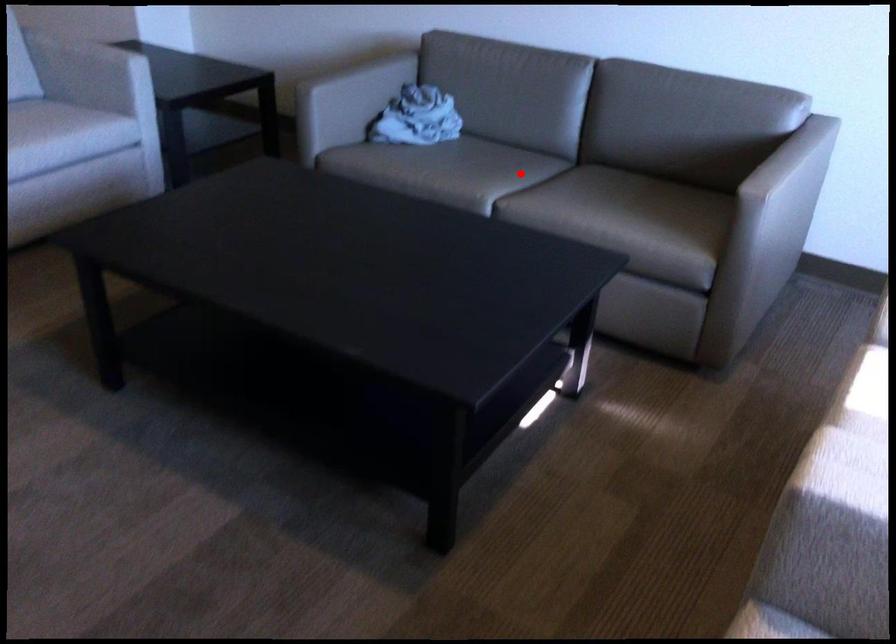
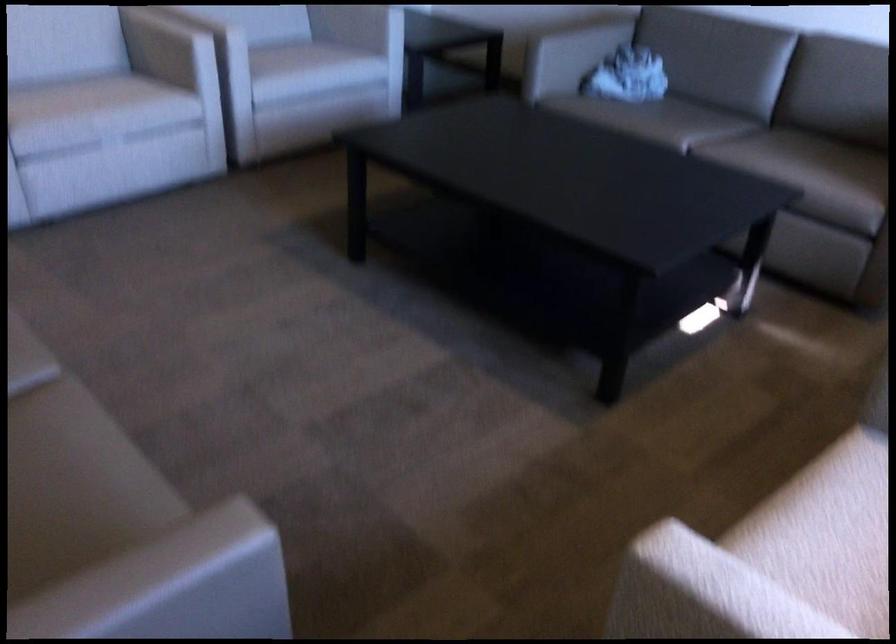
Question: I am providing you with two images of the same scene from different viewpoints. A red point is marked on the first image. Can you still see the location of the red point in image 2?

Choices:
 (A) Yes
 (B) No

Answer: (A)